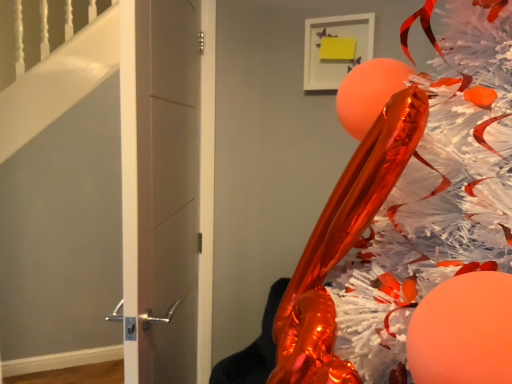
Question: Is shiny metallic christmas tree at right inside the boundaries of matte gray door at center, or outside?

Choices:
 (A) outside
 (B) inside

Answer: (A)

Question: In terms of width, does shiny metallic christmas tree at right look wider or thinner when compared to matte gray door at center?

Choices:
 (A) wide
 (B) thin

Answer: (A)

Question: Based on their sizes in the image, would you say shiny metallic christmas tree at right is bigger or smaller than matte gray door at center?

Choices:
 (A) big
 (B) small

Answer: (A)

Question: Is matte gray door at center taller or shorter than shiny metallic christmas tree at right?

Choices:
 (A) short
 (B) tall

Answer: (B)

Question: Is point [174, 248] closer or farther from the camera than point [425, 97]?

Choices:
 (A) farther
 (B) closer

Answer: (A)

Question: Which is correct: matte gray door at center is inside shiny metallic christmas tree at right, or outside of it?

Choices:
 (A) inside
 (B) outside

Answer: (B)

Question: Considering the positions of matte gray door at center and shiny metallic christmas tree at right in the image, is matte gray door at center bigger or smaller than shiny metallic christmas tree at right?

Choices:
 (A) small
 (B) big

Answer: (A)